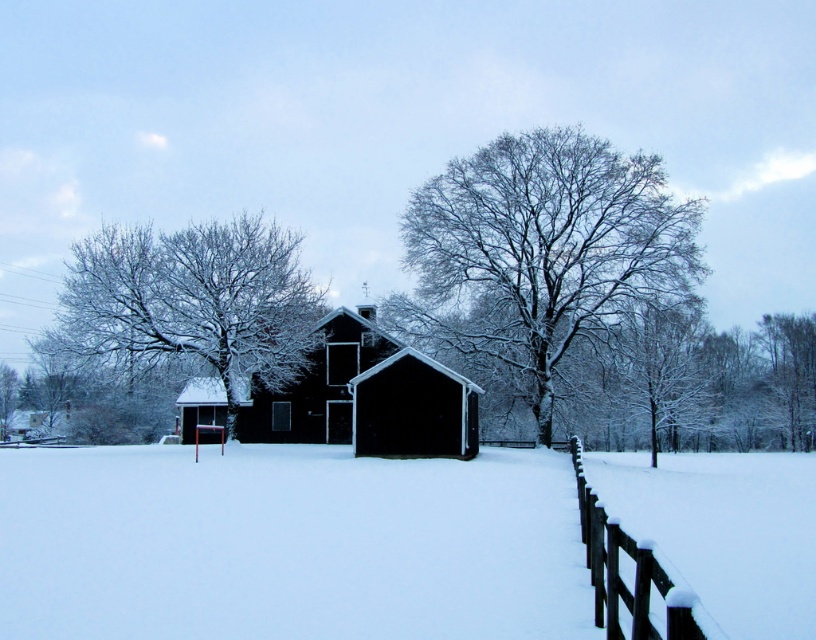
Consider the image. Is snow-covered branches at upper left further to camera compared to black matte barn at center?

Yes, snow-covered branches at upper left is further from the viewer.

Is snow-covered branches at upper left thinner than black matte barn at center?

No.

The height and width of the screenshot is (640, 816). Find the location of `snow-covered branches at upper left`. snow-covered branches at upper left is located at coordinates (191, 300).

Between point (601, 262) and point (659, 557), which one is positioned in front?

Point (659, 557)

Is point (472, 237) behind point (619, 538)?

Yes, point (472, 237) is farther from viewer.

Who is more distant from viewer, (x=546, y=252) or (x=619, y=544)?

Point (x=546, y=252)

At what (x,y) coordinates should I click in order to perform the action: click on snow-covered branches at center. Please return your answer as a coordinate pair (x, y). The height and width of the screenshot is (640, 816). Looking at the image, I should click on (540, 252).

Does point (650, 433) come behind point (763, 336)?

No, it is not.

Locate an element on the screen. snow-covered tree at center is located at coordinates (662, 368).

Locate an element on the screen. snow-covered tree at center is located at coordinates (662, 368).